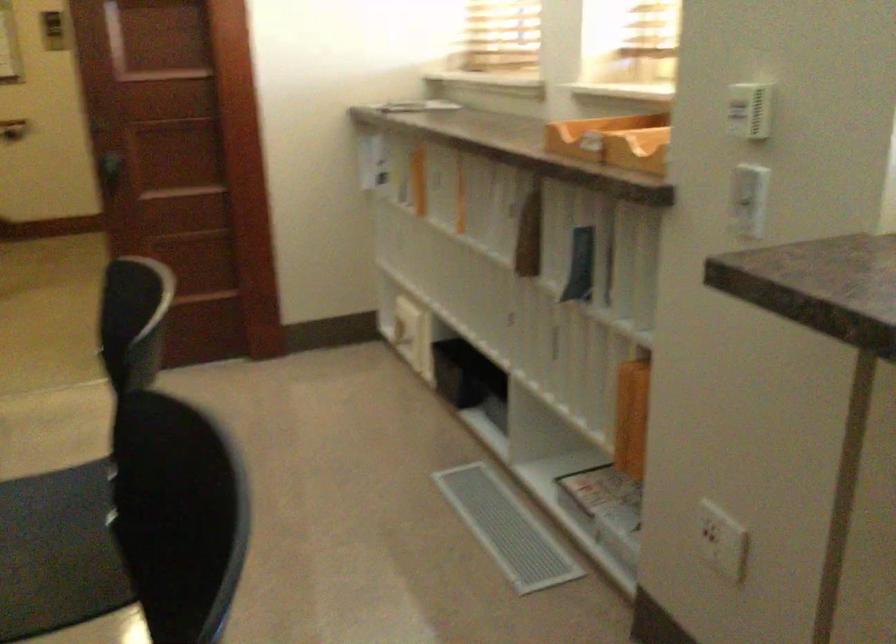
What do you see at coordinates (721, 541) in the screenshot? I see `the white power outlet` at bounding box center [721, 541].